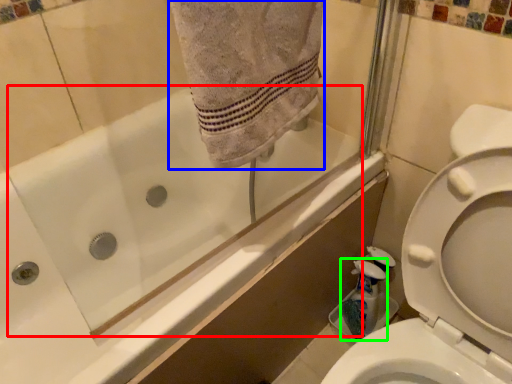
Question: Which object is the closest to the bath (highlighted by a red box)? Choose among these: bath towel (highlighted by a blue box) or cleaning product (highlighted by a green box).

Choices:
 (A) bath towel
 (B) cleaning product

Answer: (B)